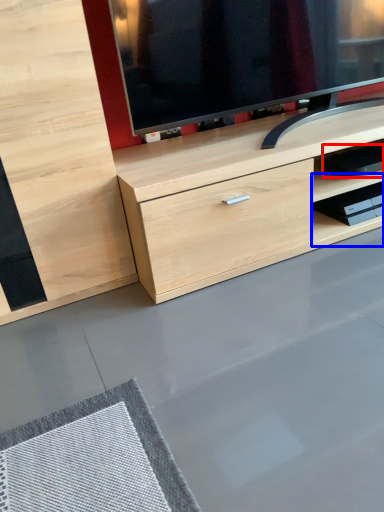
Question: Which object appears closest to the camera in this image, equipment (highlighted by a red box) or shelf (highlighted by a blue box)?

Choices:
 (A) equipment
 (B) shelf

Answer: (A)